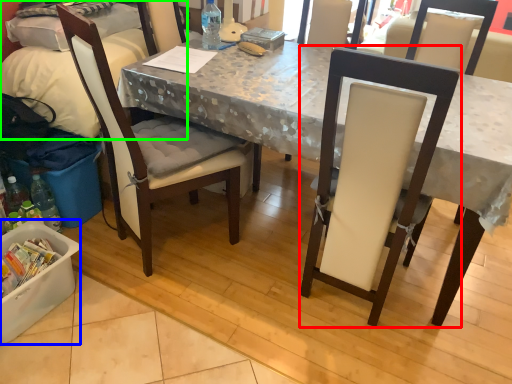
Question: Which object is positioned farthest from chair (highlighted by a red box)? Select from box (highlighted by a blue box) and leftover (highlighted by a green box).

Choices:
 (A) box
 (B) leftover

Answer: (B)